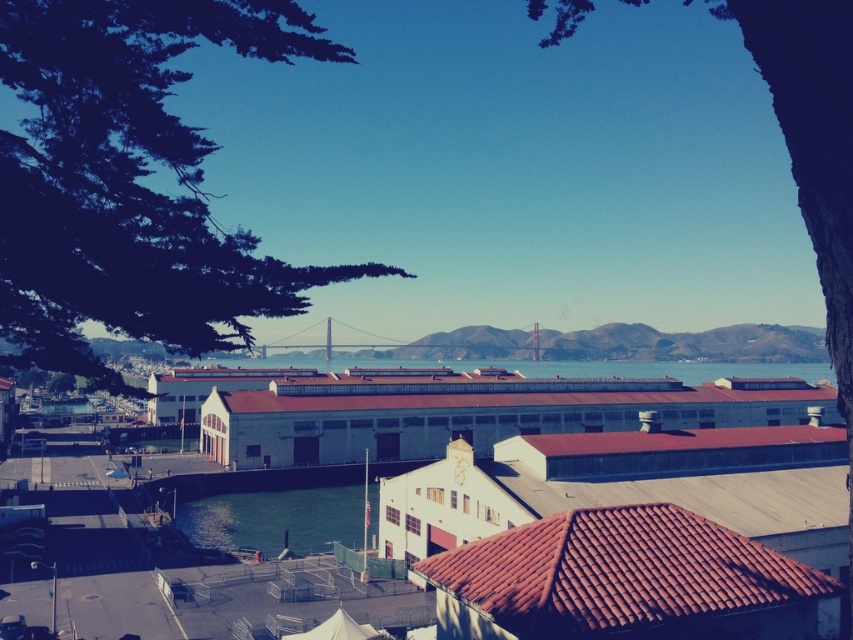
You are a photographer planning to capture the Golden Gate Bridge in the background with both the green water at lower center and clear blue water at center in the frame. Which body of water will appear closer to the camera in the photo?

The green water at lower center will appear closer to the camera because it is positioned in front of the clear blue water at center in the scene.

You are an architect designing a new building in this waterfront area. You want to ensure that the green leafy tree at upper left and the green water at lower center are both visible from the building. Based on their sizes, which object would appear larger in the building design sketches?

The green leafy tree at upper left would appear larger in the building design sketches because it is much taller than the green water at lower center.